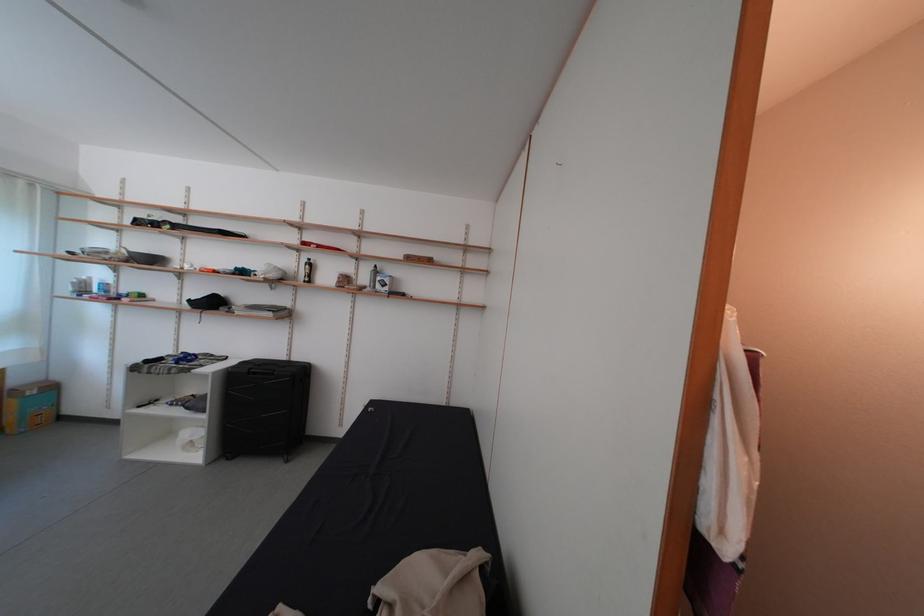
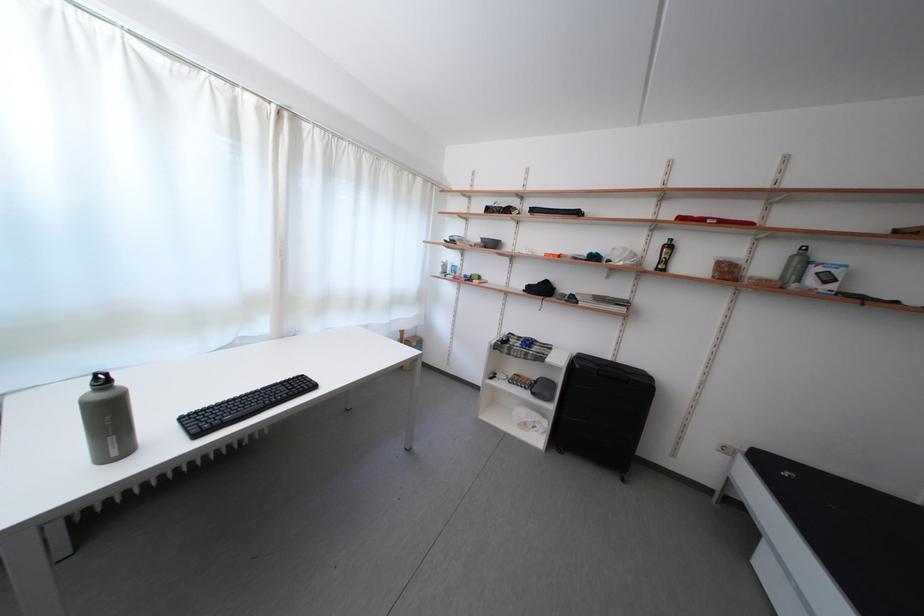
Locate, in the second image, the point that corresponds to [355,288] in the first image.

(736, 278)